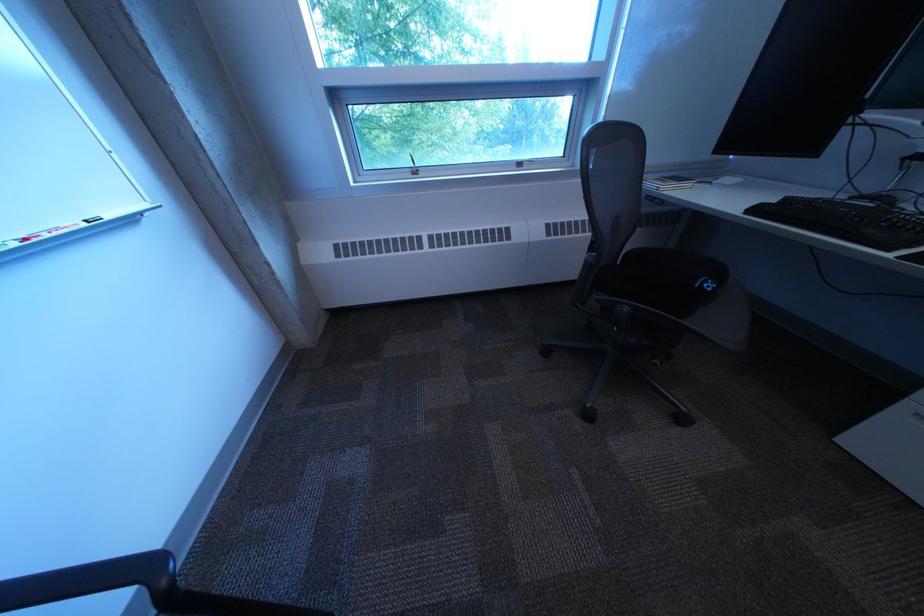
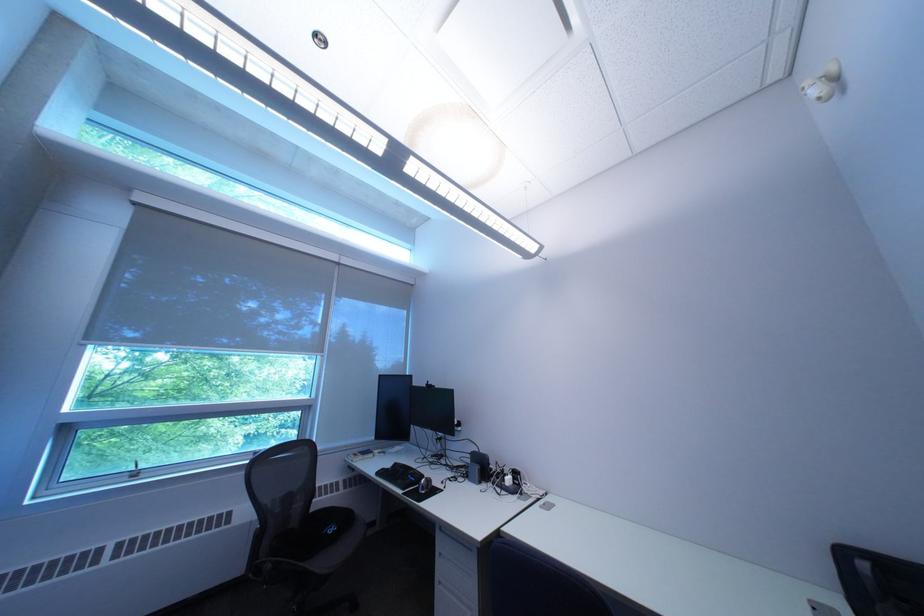
In the second image, find the point that corresponds to the point at 640,310 in the first image.

(285, 568)